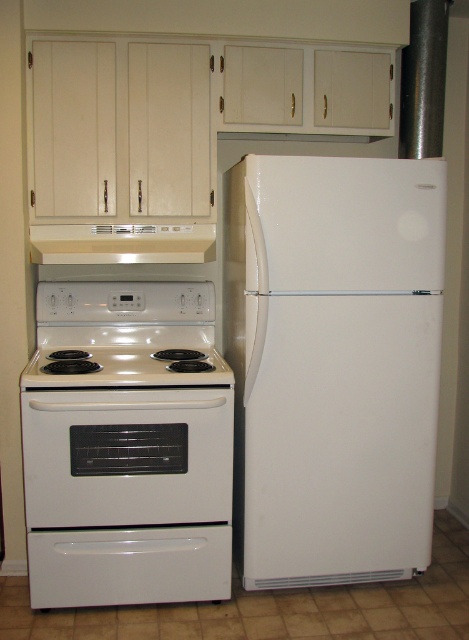
Please provide the coordinates of the white glossy electric stove at lower left in the image. The coordinates should be in the format of a point with two decimal places, like this example format point123.456, 654.321. Please strictly follow the format and do not add any extra words or explanations.

point0.(127, 639)

You are a delivery person who needs to place a small package between the white glossy electric stove at lower left and the white glossy electric stove at center. Can you fit it if the package is 8 inches wide?

The white glossy electric stove at lower left and white glossy electric stove at center are 8.21 inches apart from each other. Since the package is 8 inches wide, it can fit between them with a small amount of space to spare.